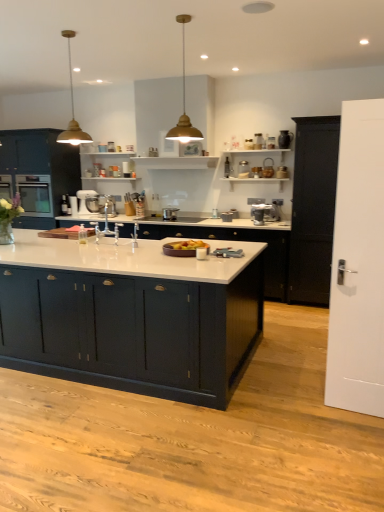
Identify the location of empty space that is ontop of gold metallic pendant light at upper center, which is the second light fixture from left to right (from a real-world perspective). The image size is (384, 512). (181, 19).